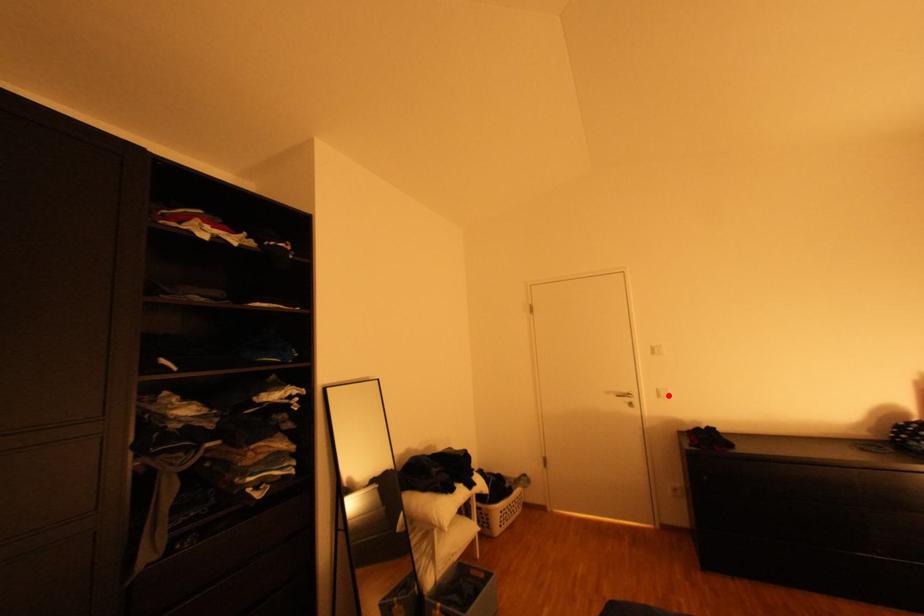
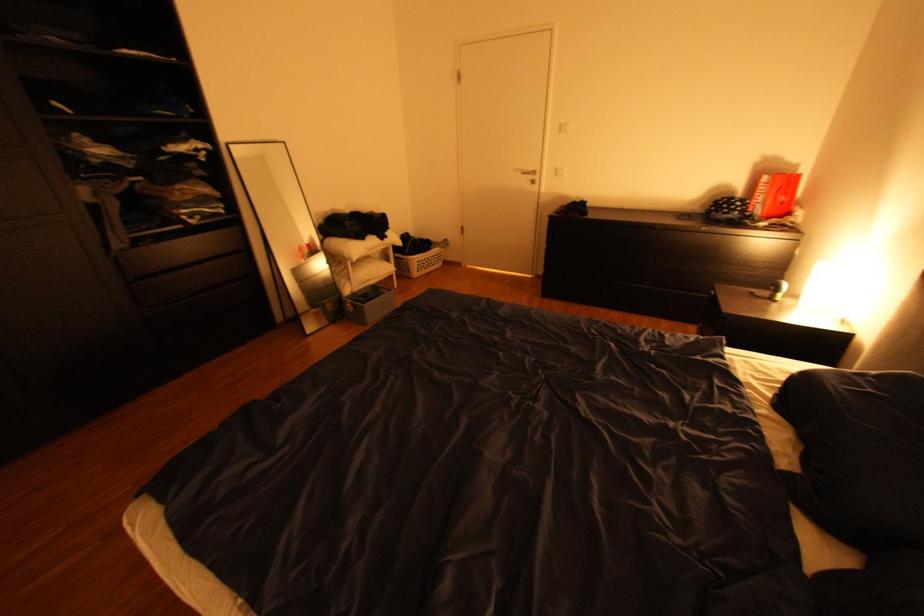
In the second image, find the point that corresponds to the highlighted location in the first image.

(565, 174)